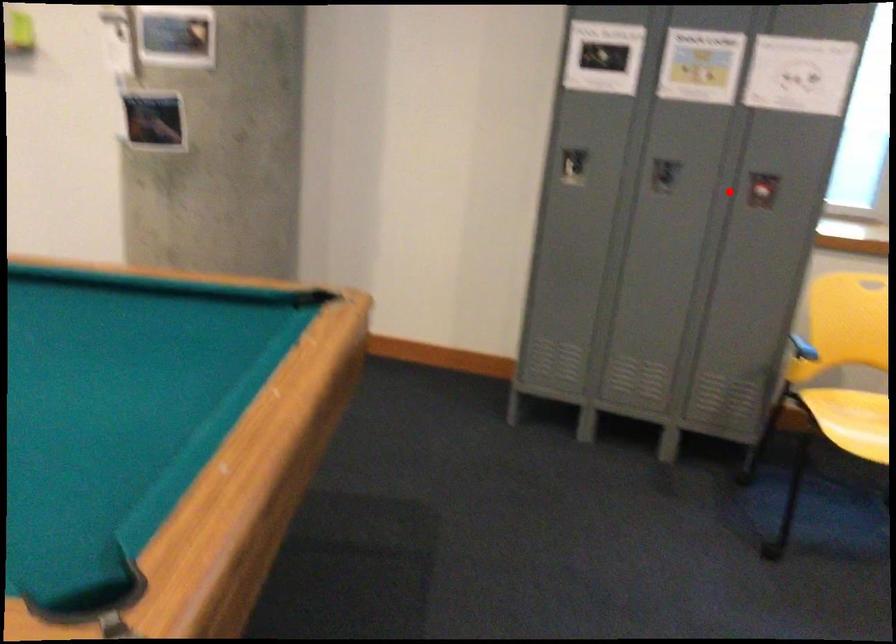
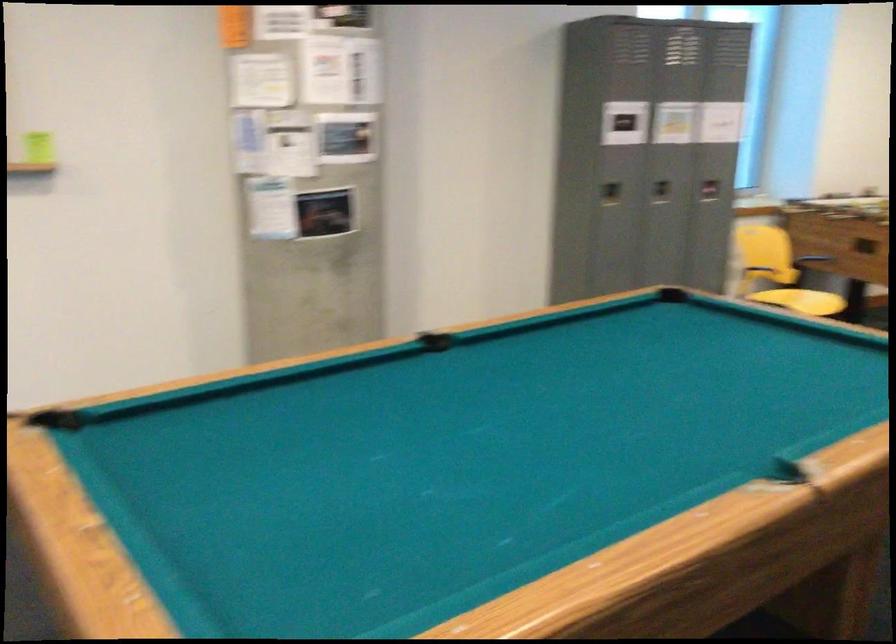
Question: I am providing you with two images of the same scene from different viewpoints. A red point is shown in image1. For the corresponding object point in image2, is it positioned nearer or farther from the camera?

Choices:
 (A) Nearer
 (B) Farther

Answer: (B)